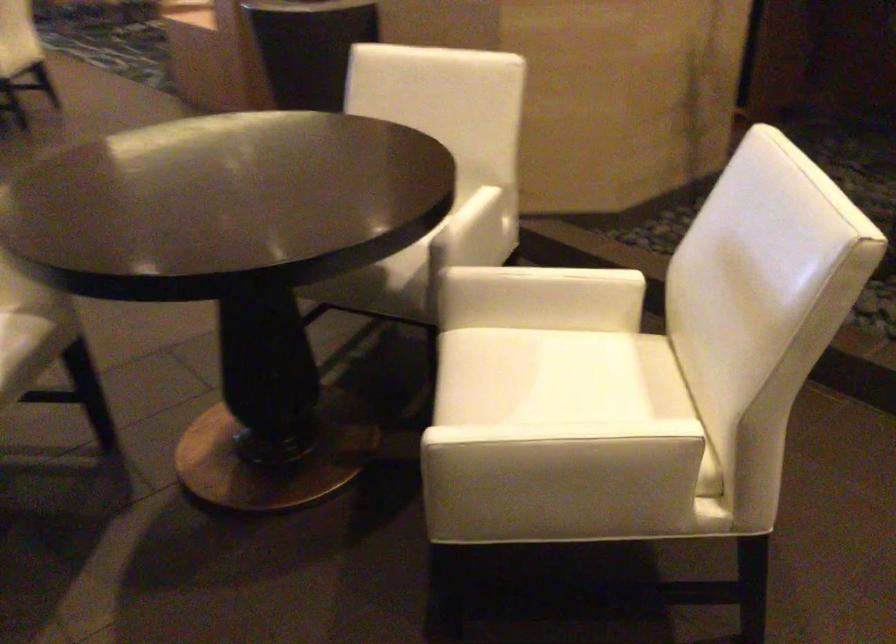
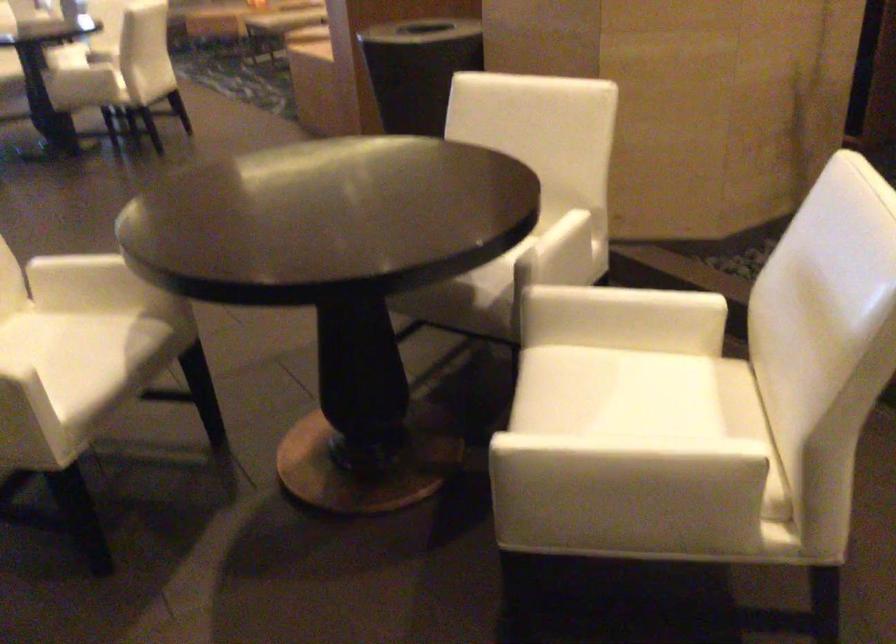
Locate, in the second image, the point that corresponds to (x=546, y=451) in the first image.

(607, 462)